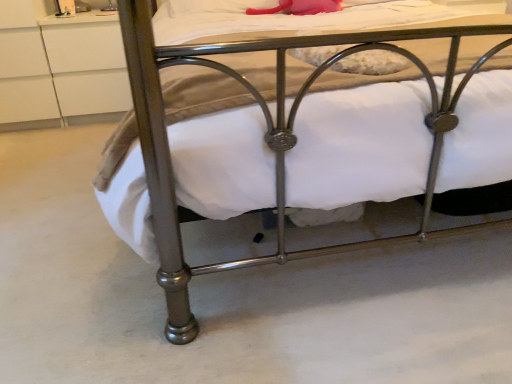
Question: Is metallic bed at lower center oriented away from white matte drawer at upper left?

Choices:
 (A) no
 (B) yes

Answer: (A)

Question: Considering the relative sizes of metallic bed at lower center and white matte drawer at upper left in the image provided, is metallic bed at lower center wider than white matte drawer at upper left?

Choices:
 (A) yes
 (B) no

Answer: (A)

Question: Considering the relative sizes of metallic bed at lower center and white matte drawer at upper left in the image provided, is metallic bed at lower center taller than white matte drawer at upper left?

Choices:
 (A) no
 (B) yes

Answer: (B)

Question: Does metallic bed at lower center turn towards white matte drawer at upper left?

Choices:
 (A) no
 (B) yes

Answer: (A)

Question: Can you confirm if metallic bed at lower center is positioned to the right of white matte drawer at upper left?

Choices:
 (A) yes
 (B) no

Answer: (A)

Question: Would you say metallic bed at lower center is a long distance from white matte drawer at upper left?

Choices:
 (A) no
 (B) yes

Answer: (B)

Question: Is metallic bed at lower center located within white matte drawer at upper left?

Choices:
 (A) no
 (B) yes

Answer: (A)

Question: Does white matte drawer at upper left have a greater height compared to metallic bed at lower center?

Choices:
 (A) yes
 (B) no

Answer: (B)

Question: Is white matte drawer at upper left at the right side of metallic bed at lower center?

Choices:
 (A) no
 (B) yes

Answer: (A)

Question: From the image's perspective, is white matte drawer at upper left over metallic bed at lower center?

Choices:
 (A) no
 (B) yes

Answer: (B)

Question: Does white matte drawer at upper left have a larger size compared to metallic bed at lower center?

Choices:
 (A) no
 (B) yes

Answer: (A)

Question: Is the position of white matte drawer at upper left more distant than that of metallic bed at lower center?

Choices:
 (A) no
 (B) yes

Answer: (B)

Question: Based on their sizes in the image, would you say white matte drawer at upper left is bigger or smaller than metallic bed at lower center?

Choices:
 (A) small
 (B) big

Answer: (A)